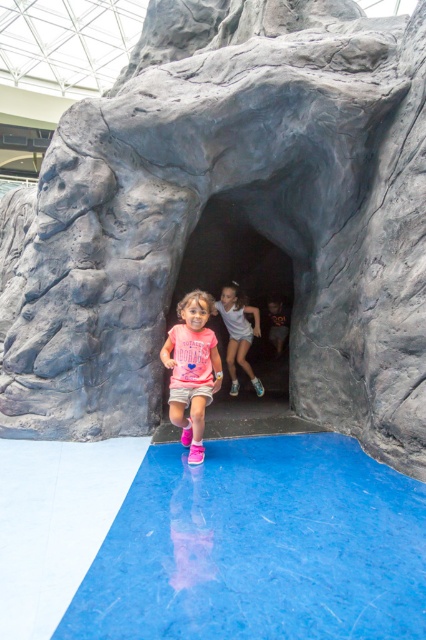
Is point (160, 352) farther from viewer compared to point (238, 348)?

No, it is not.

Who is more forward, (198, 412) or (247, 312)?

Point (198, 412) is more forward.

Where is `pink matte shorts at center`? The width and height of the screenshot is (426, 640). pink matte shorts at center is located at coordinates click(x=192, y=369).